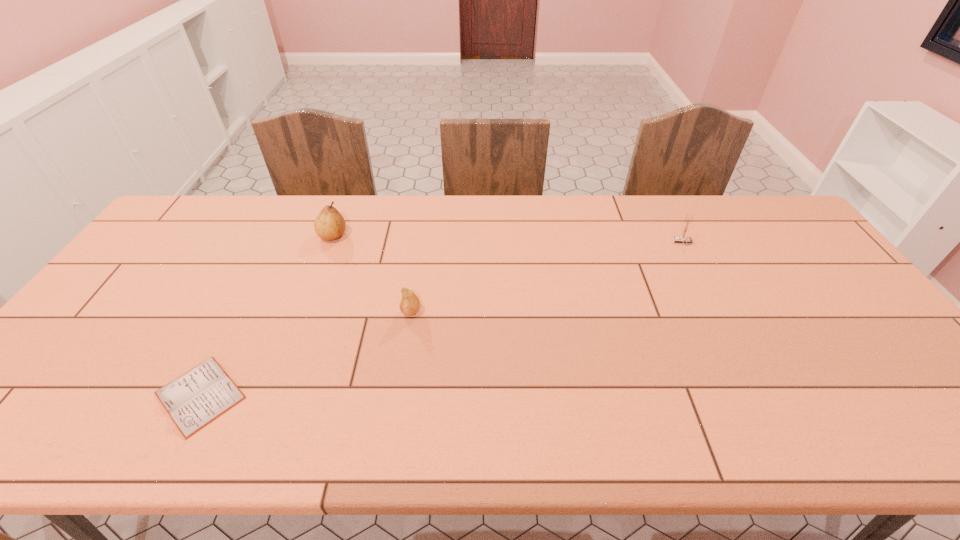
Locate an element on the screen. free space that satisfies the following two spatial constraints: 1. on the back side of the second nearest object; 2. on the left side of the diary is located at coordinates (244, 311).

Identify the location of vacant space that satisfies the following two spatial constraints: 1. on the back side of the right pear; 2. on the right side of the rightmost object. (421, 242).

Identify the location of free space in the image that satisfies the following two spatial constraints: 1. on the back side of the rightmost object; 2. on the left side of the leftmost object. (279, 242).